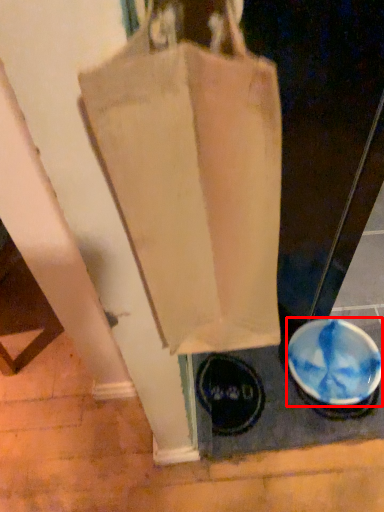
Question: Observing the image, what is the correct spatial positioning of bowl (annotated by the red box) in reference to handbag?

Choices:
 (A) right
 (B) left

Answer: (A)